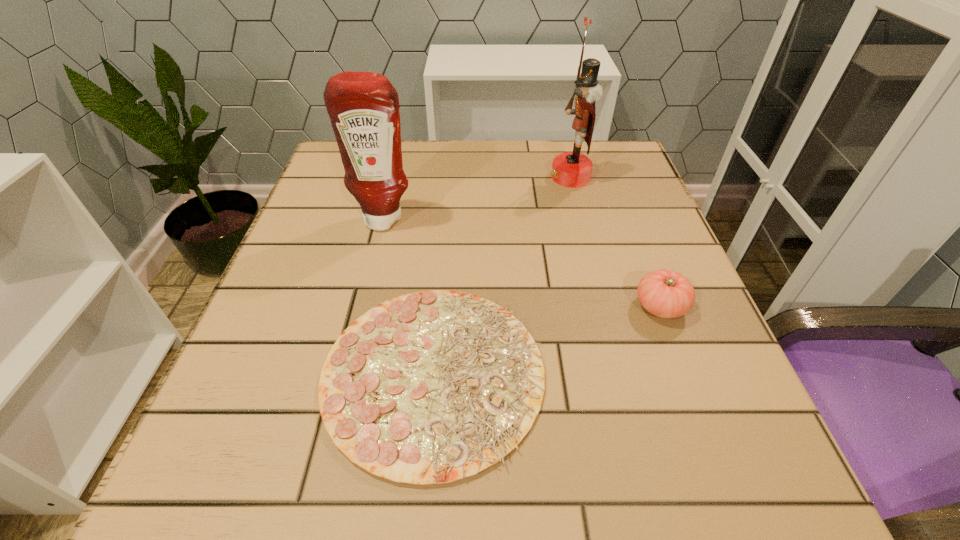
Identify the location of the second object from right to left. The height and width of the screenshot is (540, 960). (569, 169).

The width and height of the screenshot is (960, 540). I want to click on the farthest object, so click(x=569, y=169).

Where is `the second farthest object`? the second farthest object is located at coordinates (363, 107).

At what (x,y) coordinates should I click in order to perform the action: click on tomato. Please return your answer as a coordinate pair (x, y). This screenshot has height=540, width=960. Looking at the image, I should click on [664, 293].

You are a GUI agent. You are given a task and a screenshot of the screen. Output one action in this format:
    pyautogui.click(x=<x>, y=<y>)
    Task: Click on the second shortest object
    This screenshot has height=540, width=960.
    Given the screenshot: What is the action you would take?
    pyautogui.click(x=664, y=293)

This screenshot has width=960, height=540. What are the coordinates of `pizza` in the screenshot? It's located at (430, 387).

The width and height of the screenshot is (960, 540). What are the coordinates of `vacant space located on the front-facing side of the nutcracker` in the screenshot? It's located at (525, 177).

Find the location of a particular element. Image resolution: width=960 pixels, height=540 pixels. free space located 0.320m on the front-facing side of the nutcracker is located at coordinates (415, 177).

Find the location of a particular element. This screenshot has width=960, height=540. vacant region located 0.080m on the front-facing side of the nutcracker is located at coordinates (516, 177).

The image size is (960, 540). I want to click on vacant space located 0.050m on the back of the condiment, so click(x=391, y=193).